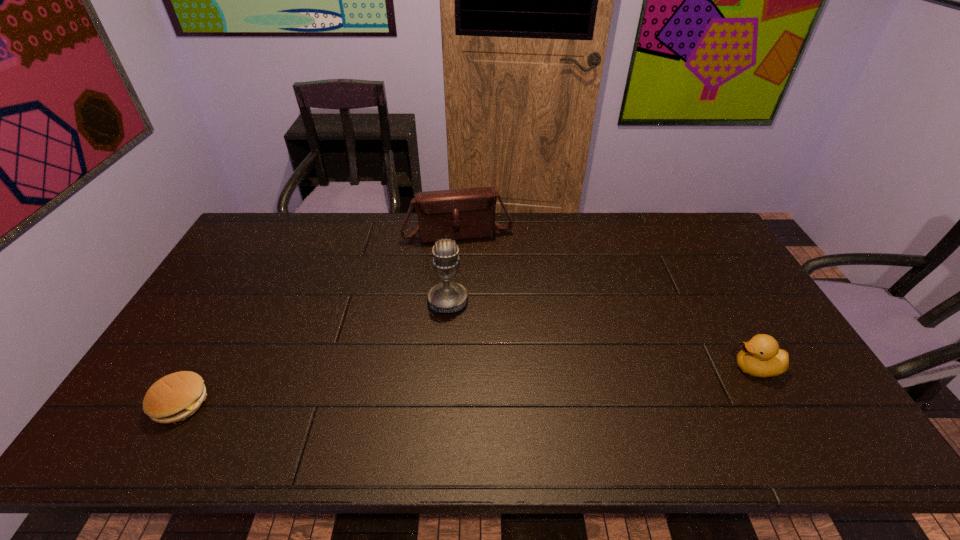
The height and width of the screenshot is (540, 960). In order to click on duckling that is positioned at the near edge in this screenshot , I will do `click(760, 357)`.

Identify the location of object that is at the left edge. 174,397.

This screenshot has height=540, width=960. In order to click on object at the right edge in this screenshot , I will do `click(760, 357)`.

The height and width of the screenshot is (540, 960). Find the location of `object positioned at the near left corner`. object positioned at the near left corner is located at coordinates (174, 397).

Find the location of a particular element. object located at the near right corner is located at coordinates (760, 357).

This screenshot has width=960, height=540. In order to click on free space at the far edge in this screenshot , I will do `click(663, 227)`.

In the image, there is a desktop. At what (x,y) coordinates should I click in order to perform the action: click on free space at the near edge. Please return your answer as a coordinate pair (x, y). Image resolution: width=960 pixels, height=540 pixels. Looking at the image, I should click on (565, 404).

You are a GUI agent. You are given a task and a screenshot of the screen. Output one action in this format:
    pyautogui.click(x=<x>, y=<y>)
    Task: Click on the vacant space at the left edge
    This screenshot has height=540, width=960.
    Given the screenshot: What is the action you would take?
    pyautogui.click(x=226, y=349)

At what (x,y) coordinates should I click in order to perform the action: click on vacant space at the right edge of the desktop. Please return your answer as a coordinate pair (x, y). Looking at the image, I should click on (717, 312).

In the image, there is a desktop. At what (x,y) coordinates should I click in order to perform the action: click on free region at the far left corner. Please return your answer as a coordinate pair (x, y). This screenshot has width=960, height=540. Looking at the image, I should click on (292, 224).